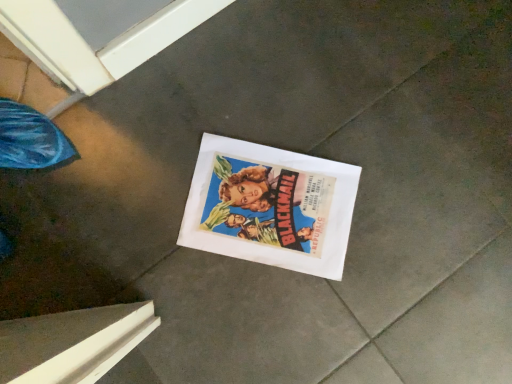
Where is `vacant region above matte paper flyer at center (from a real-world perspective)`? The width and height of the screenshot is (512, 384). vacant region above matte paper flyer at center (from a real-world perspective) is located at coordinates (268, 202).